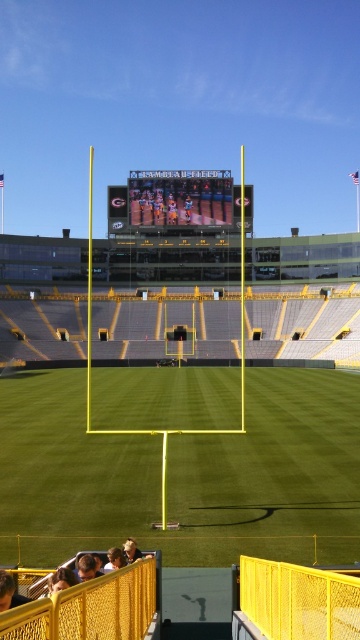
Question: Which object is farther from the camera taking this photo?

Choices:
 (A) yellow jersey at center
 (B) matte black scoreboard at center
 (C) green artificial turf at center

Answer: (A)

Question: Considering the real-world distances, which object is closest to the blonde hair at lower center?

Choices:
 (A) green artificial turf at center
 (B) yellow jersey at center
 (C) light brown wooden chair at lower center

Answer: (C)

Question: Is matte black scoreboard at center above light brown wooden chair at lower center?

Choices:
 (A) yes
 (B) no

Answer: (A)

Question: Is dark brown leather jacket at lower left thinner than blonde hair at lower center?

Choices:
 (A) no
 (B) yes

Answer: (B)

Question: Can you confirm if matte black scoreboard at center is smaller than light brown hair at lower left?

Choices:
 (A) yes
 (B) no

Answer: (B)

Question: Which object appears farthest from the camera in this image?

Choices:
 (A) matte black scoreboard at center
 (B) light brown wooden chair at lower center
 (C) light brown hair at lower left

Answer: (A)